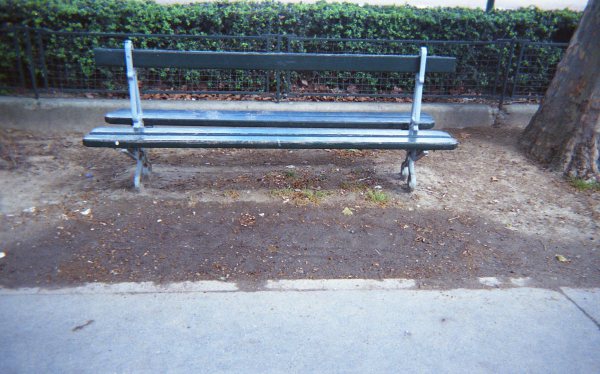
At what (x,y) coordinates should I click in order to perform the action: click on bench back support. Please return your answer as a coordinate pair (x, y). Looking at the image, I should click on (243, 62).